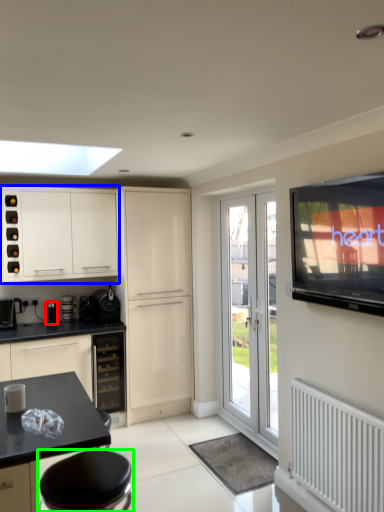
Question: Based on their relative distances, which object is nearer to appliance (highlighted by a red box)? Choose from cabinetry (highlighted by a blue box) and bar stool (highlighted by a green box).

Choices:
 (A) cabinetry
 (B) bar stool

Answer: (A)